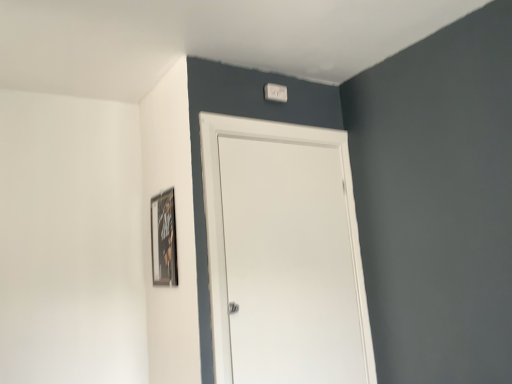
Question: In terms of size, does white plastic light switch at upper center appear bigger or smaller than wooden framed poster at upper left?

Choices:
 (A) big
 (B) small

Answer: (B)

Question: From the image's perspective, is white plastic light switch at upper center located above or below wooden framed poster at upper left?

Choices:
 (A) below
 (B) above

Answer: (B)

Question: Which object is positioned closest to the white matte door at center?

Choices:
 (A) white plastic light switch at upper center
 (B) wooden framed poster at upper left

Answer: (B)

Question: Estimate the real-world distances between objects in this image. Which object is farther from the wooden framed poster at upper left?

Choices:
 (A) white matte door at center
 (B) white plastic light switch at upper center

Answer: (B)